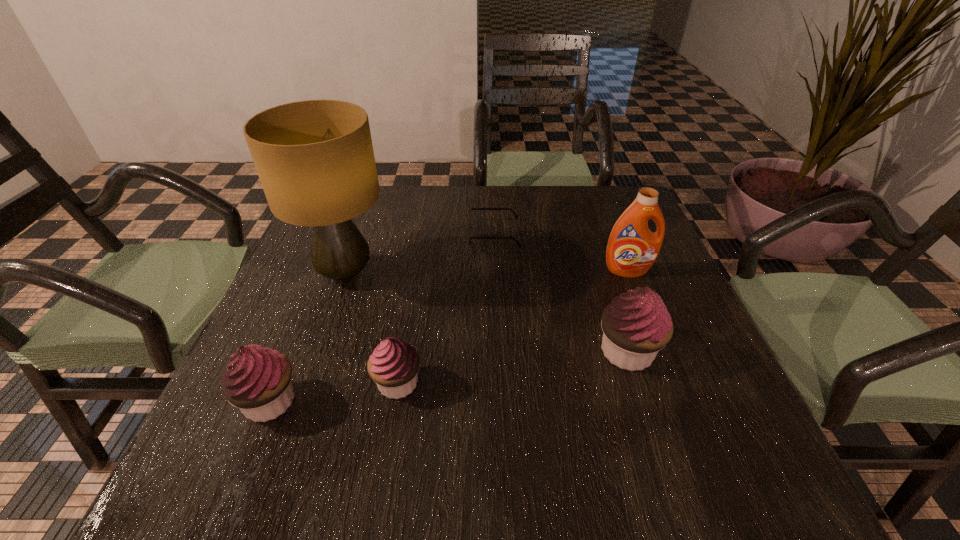
Identify the location of free space that is in between the tallest object and the spectacles. Image resolution: width=960 pixels, height=540 pixels. (420, 254).

Image resolution: width=960 pixels, height=540 pixels. Find the location of `vacant space that's between the shortest cupcake and the second shortest cupcake`. vacant space that's between the shortest cupcake and the second shortest cupcake is located at coordinates (334, 392).

At what (x,y) coordinates should I click in order to perform the action: click on free space between the rightmost cupcake and the leftmost cupcake. Please return your answer as a coordinate pair (x, y). Looking at the image, I should click on (449, 376).

Find the location of a particular element. vacant point located between the rightmost cupcake and the shortest cupcake is located at coordinates (513, 367).

The width and height of the screenshot is (960, 540). What are the coordinates of `free space that is in between the detergent and the shortest object` in the screenshot? It's located at (561, 253).

Image resolution: width=960 pixels, height=540 pixels. I want to click on empty location between the tallest object and the third shortest object, so click(x=308, y=337).

Identify the location of free space between the fourth object from right to left and the detergent. The image size is (960, 540). (513, 327).

You are a GUI agent. You are given a task and a screenshot of the screen. Output one action in this format:
    pyautogui.click(x=<x>, y=<y>)
    Task: Click on the object that stands as the second closest to the detergent
    This screenshot has height=540, width=960.
    Given the screenshot: What is the action you would take?
    coord(469,221)

Where is `object that stands as the second closest to the second tallest object`? object that stands as the second closest to the second tallest object is located at coordinates (469, 221).

Choose which cupcake is the nearest neighbor to the fourth tallest object. Please provide its 2D coordinates. Your answer should be formatted as a tuple, i.e. [(x, y)], where the tuple contains the x and y coordinates of a point satisfying the conditions above.

[(393, 366)]